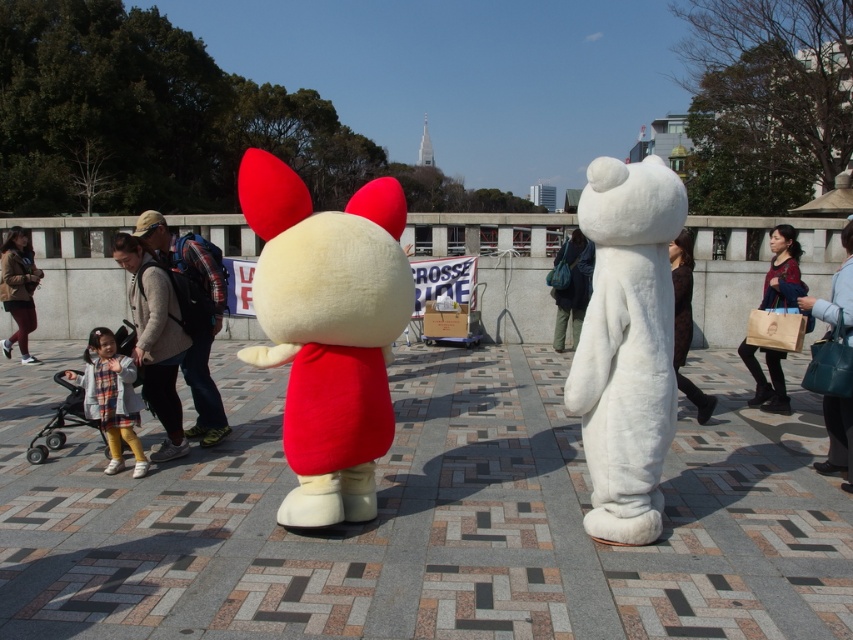
Does fluffy white mascot at center have a lesser width compared to velvet blue coat at center?

Incorrect, fluffy white mascot at center's width is not less than velvet blue coat at center's.

From the picture: Does fluffy white mascot at center appear under velvet blue coat at center?

Yes, fluffy white mascot at center is below velvet blue coat at center.

Between point (294, 410) and point (558, 253), which one is positioned behind?

The point (558, 253) is behind.

The image size is (853, 640). Find the location of `fluffy white mascot at center`. fluffy white mascot at center is located at coordinates (328, 330).

Who is more forward, [280,268] or [605,440]?

Positioned in front is point [280,268].

Between point (257, 291) and point (665, 408), which one is positioned behind?

Point (257, 291)

Does point (309, 273) lie in front of point (590, 403)?

That is True.

In order to click on fluffy white mascot at center in this screenshot , I will do [328, 330].

Does leather handbag at right lie in front of brown leather jacket at left?

Yes, it is in front of brown leather jacket at left.

Who is taller, leather handbag at right or brown leather jacket at left?

brown leather jacket at left

Does point (830, 468) lie in front of point (9, 253)?

Yes, it is in front of point (9, 253).

Find the location of a particular element. leather handbag at right is located at coordinates (836, 294).